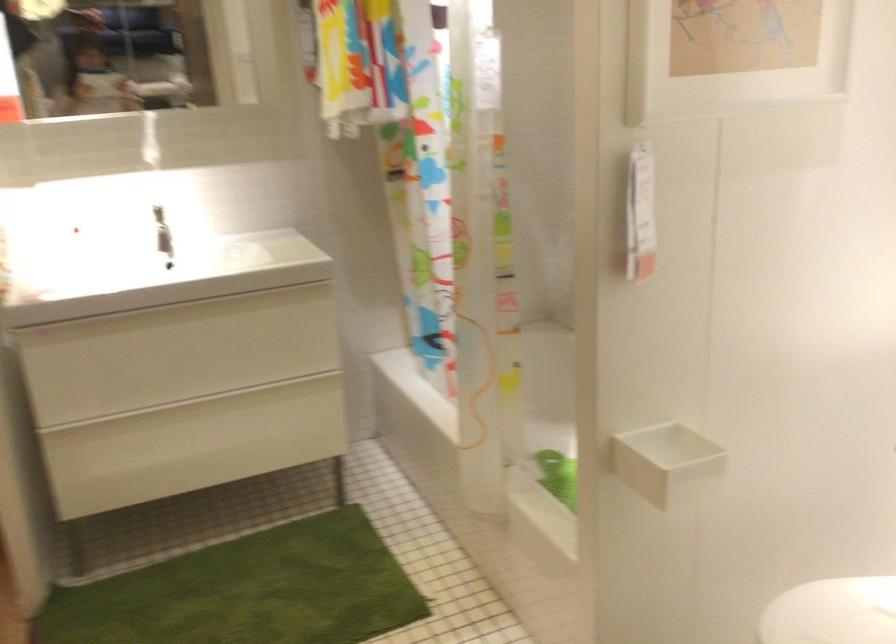
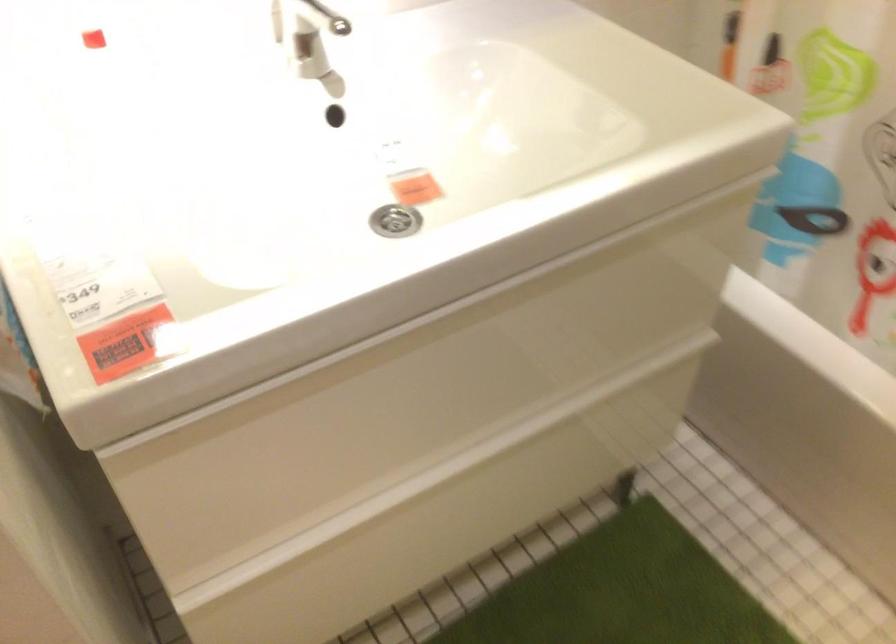
Find the pixel in the second image that matches point (192, 303) in the first image.

(394, 221)